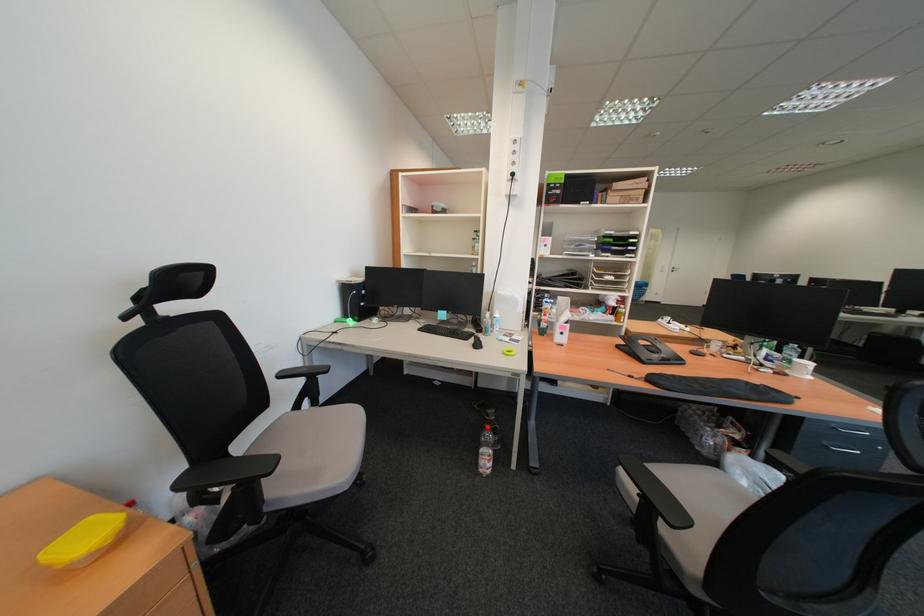
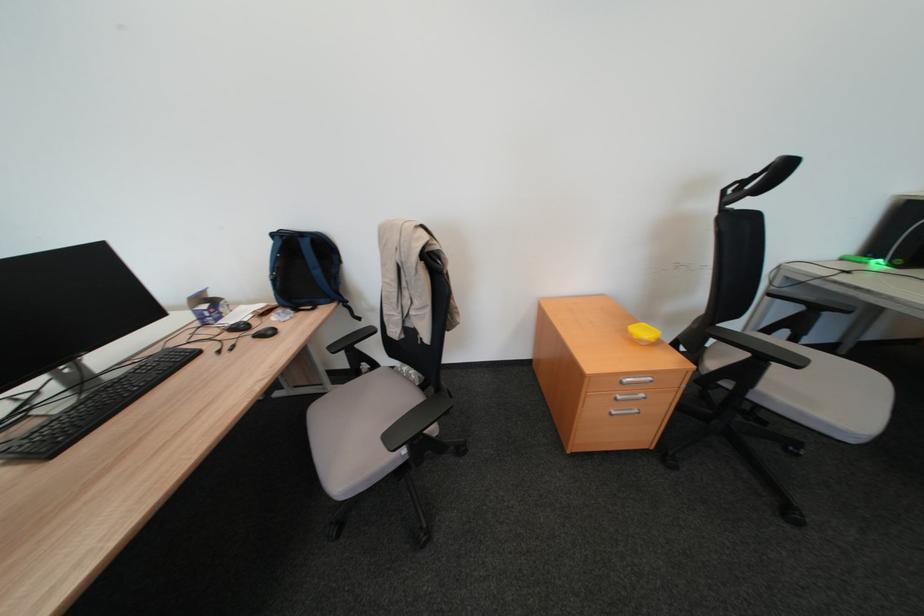
Based on the continuous images, in which direction is the camera rotating?

The camera's rotation is toward left-down.